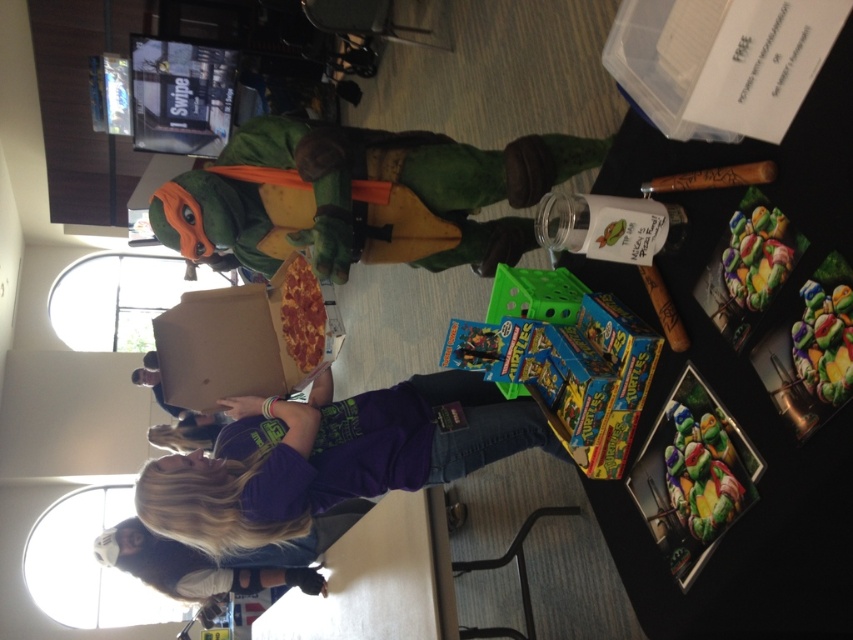
Question: Does blue cardboard toy at center have a greater width compared to cardboard pizza box at center?

Choices:
 (A) yes
 (B) no

Answer: (B)

Question: Considering the real-world distances, which object is farthest from the cardboard pizza box at center?

Choices:
 (A) purple cotton shirt at center
 (B) shiny plastic cookies at lower right
 (C) blonde hair at lower center

Answer: (C)

Question: Does blue cardboard toy at center lie behind blonde hair at lower center?

Choices:
 (A) yes
 (B) no

Answer: (B)

Question: Which point appears farthest from the camera in this image?

Choices:
 (A) (157, 570)
 (B) (169, 513)
 (C) (265, 332)

Answer: (A)

Question: Which is farther from the blonde hair at lower center?

Choices:
 (A) velvet green costume at center
 (B) cardboard pizza box at center

Answer: (A)

Question: Where is purple cotton shirt at center located in relation to multicolored plastic cookies at right in the image?

Choices:
 (A) left
 (B) right

Answer: (A)